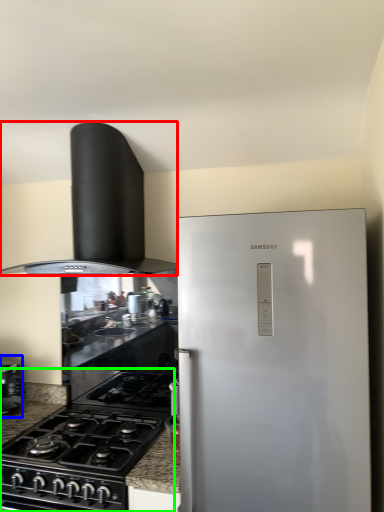
Question: Which is nearer to the home appliance (highlighted by a red box)? kitchen appliance (highlighted by a blue box) or gas stove (highlighted by a green box).

Choices:
 (A) kitchen appliance
 (B) gas stove

Answer: (B)